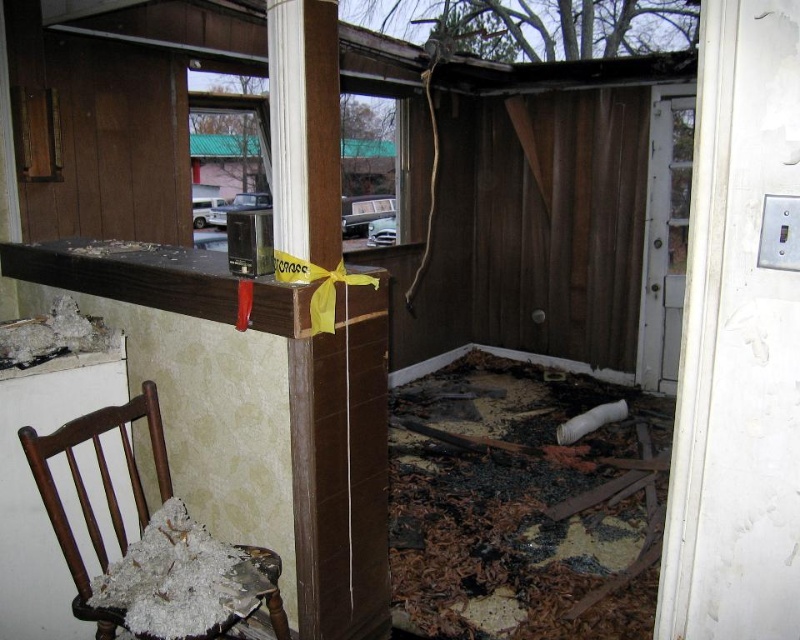
Question: Which of the following is the farthest from the observer?

Choices:
 (A) (320, 166)
 (B) (162, 435)

Answer: (B)

Question: Is charcoal debris at lower center to the left of wooden chair with shredded fabric at lower left from the viewer's perspective?

Choices:
 (A) yes
 (B) no

Answer: (B)

Question: Is charcoal debris at lower center above wooden chair with shredded fabric at lower left?

Choices:
 (A) yes
 (B) no

Answer: (B)

Question: Which point is farther from the camera taking this photo?

Choices:
 (A) (197, 637)
 (B) (328, 160)
 (C) (537, 560)

Answer: (C)

Question: Which object appears farthest from the camera in this image?

Choices:
 (A) charcoal debris at lower center
 (B) brown wood pillar at center

Answer: (A)

Question: Is brown wood pillar at center positioned behind wooden chair with shredded fabric at lower left?

Choices:
 (A) yes
 (B) no

Answer: (B)